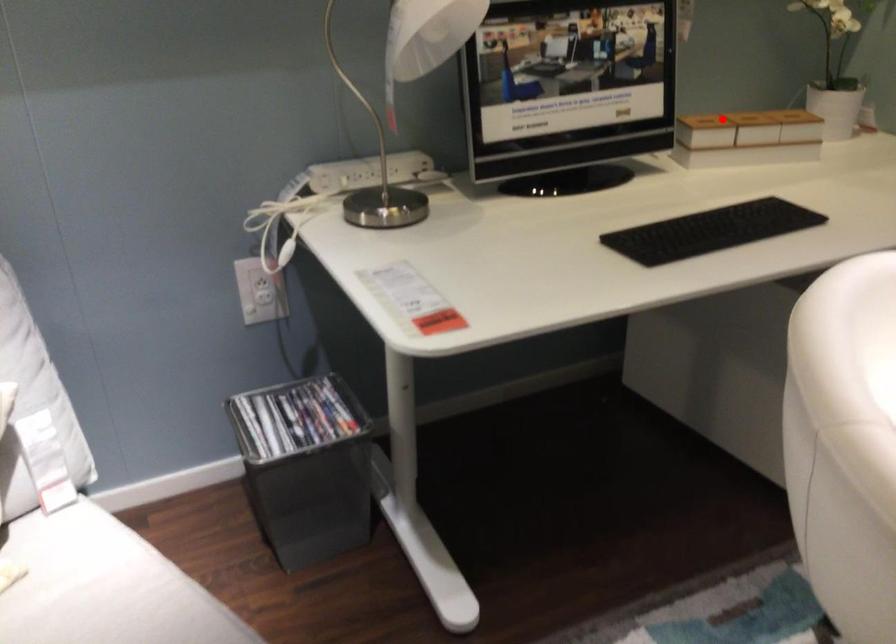
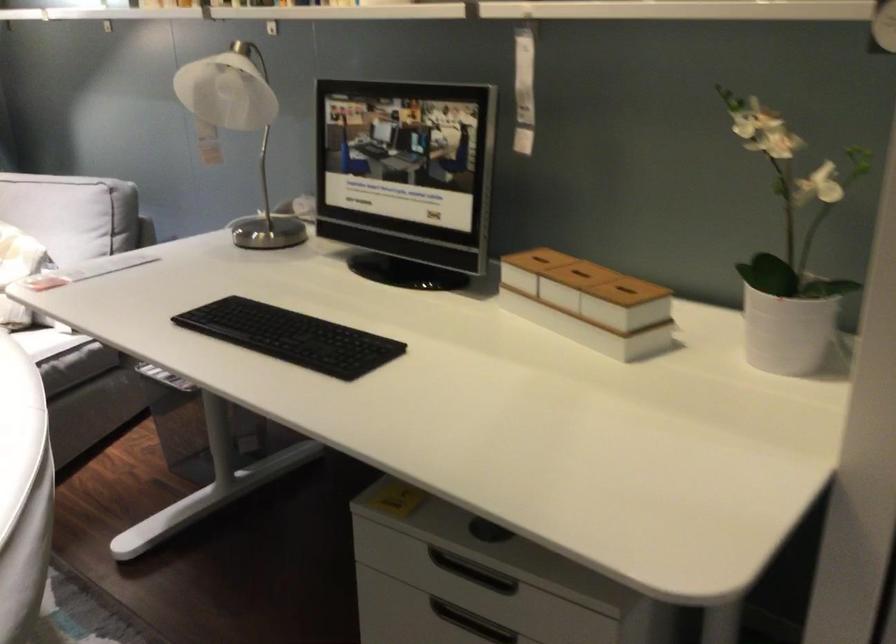
Question: I am providing you with two images of the same scene from different viewpoints. A red point is shown in image1. For the corresponding object point in image2, is it positioned nearer or farther from the camera?

Choices:
 (A) Nearer
 (B) Farther

Answer: (A)